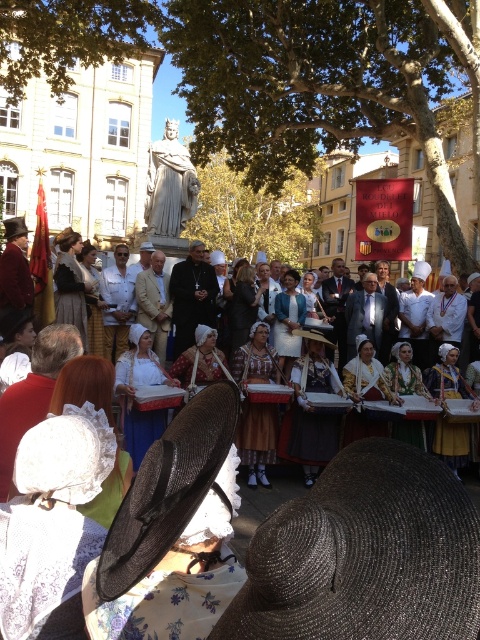
Question: Which object is closer to the camera taking this photo?

Choices:
 (A) black straw hat at lower left
 (B) silver metallic straw hat at lower center

Answer: (B)

Question: Is silver metallic straw hat at lower center to the right of black straw hat at lower left from the viewer's perspective?

Choices:
 (A) yes
 (B) no

Answer: (A)

Question: Among these objects, which one is nearest to the camera?

Choices:
 (A) silver metallic straw hat at lower center
 (B) black straw hat at lower left

Answer: (A)

Question: Considering the relative positions of silver metallic straw hat at lower center and black straw hat at lower left in the image provided, where is silver metallic straw hat at lower center located with respect to black straw hat at lower left?

Choices:
 (A) below
 (B) above

Answer: (A)

Question: Does silver metallic straw hat at lower center appear on the right side of black straw hat at lower left?

Choices:
 (A) yes
 (B) no

Answer: (A)

Question: Among these points, which one is farthest from the camera?

Choices:
 (A) [x=322, y=579]
 (B) [x=158, y=499]

Answer: (B)